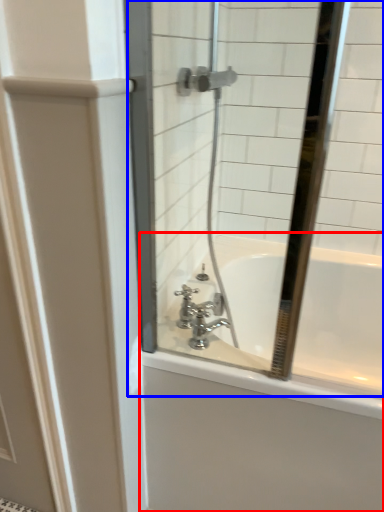
Question: Which object appears farthest to the camera in this image, bathtub (highlighted by a red box) or mirror (highlighted by a blue box)?

Choices:
 (A) bathtub
 (B) mirror

Answer: (A)